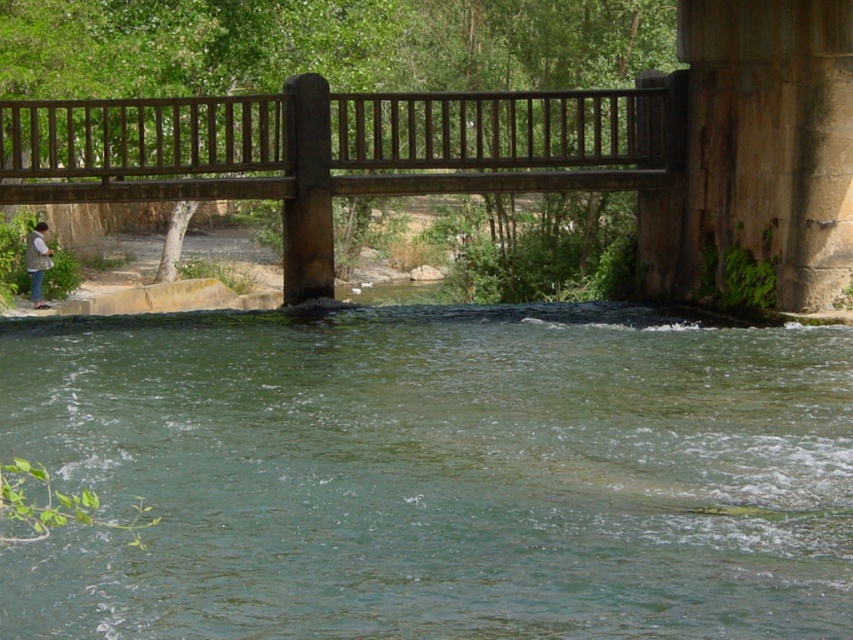
Based on the photo, you are standing on the brown wooden bridge at upper center and want to see the clear water at center. In which direction should you look?

You should look to the right because the clear water at center is to the right of the brown wooden bridge at upper center.

You are standing on the bank of the river and see the brown wooden bridge at upper center and the denim jacket at lower left. Which object is bigger in size?

The brown wooden bridge at upper center is larger in size than the denim jacket at lower left.

You are standing on the brown wooden bridge at upper center and looking down at the clear water at center. Which object is closer to the ground?

The clear water at center is closer to the ground than the brown wooden bridge at upper center because it is shorter in height.